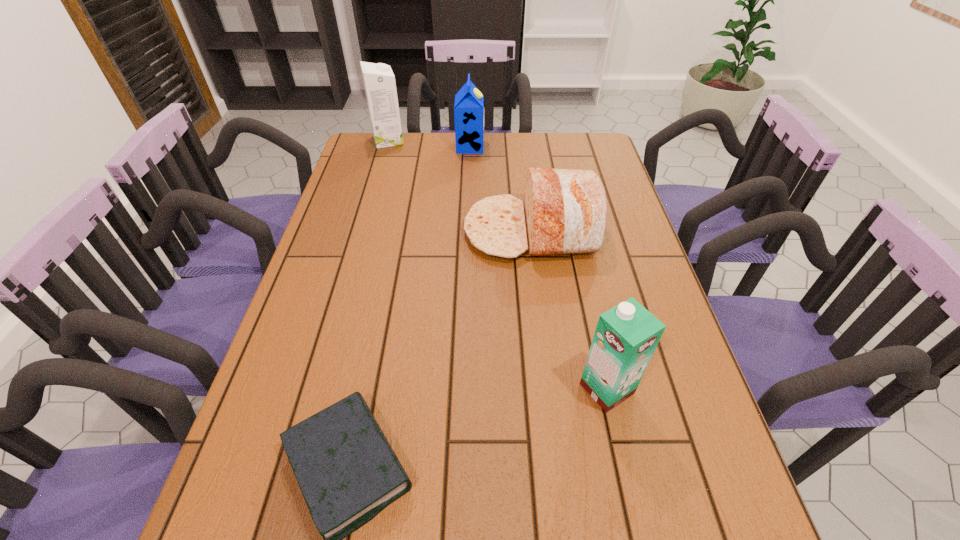
Image resolution: width=960 pixels, height=540 pixels. In order to click on the leftmost carton in this screenshot , I will do `click(379, 82)`.

The height and width of the screenshot is (540, 960). Identify the location of the second carton from right to left. (469, 105).

The height and width of the screenshot is (540, 960). I want to click on the nearest carton, so 626,336.

Where is `the third farthest object`? The image size is (960, 540). the third farthest object is located at coordinates (566, 210).

Where is `bread`? Image resolution: width=960 pixels, height=540 pixels. bread is located at coordinates (566, 210).

Find the location of a particular element. vacant area located on the front of the leftmost carton is located at coordinates (383, 157).

Locate an element on the screen. The image size is (960, 540). vacant area situated with the cap open on the second carton from left to right is located at coordinates (529, 147).

Image resolution: width=960 pixels, height=540 pixels. Identify the location of vacant space situated on the left of the nearest carton. (459, 389).

Identify the location of blank space located 0.270m at the sliced end of the third nearest object. (372, 231).

Image resolution: width=960 pixels, height=540 pixels. I want to click on free region located at the sliced end of the third nearest object, so click(x=349, y=231).